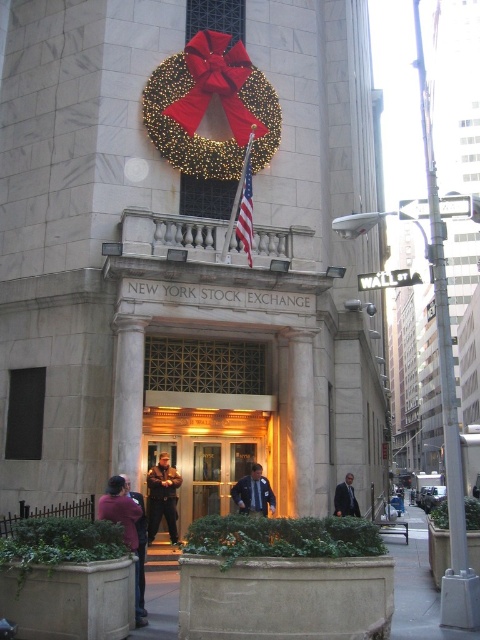
Is iridescent gold wreath at upper center thinner than american flag at center?

In fact, iridescent gold wreath at upper center might be wider than american flag at center.

Is iridescent gold wreath at upper center below american flag at center?

Incorrect, iridescent gold wreath at upper center is not positioned below american flag at center.

Does point (249, 113) come closer to viewer compared to point (242, 216)?

No.

At what (x,y) coordinates should I click in order to perform the action: click on iridescent gold wreath at upper center. Please return your answer as a coordinate pair (x, y). The width and height of the screenshot is (480, 640). Looking at the image, I should click on (206, 106).

Which is above, brown leather jacket at center or dark purple jacket at lower left?

Positioned higher is dark purple jacket at lower left.

Between brown leather jacket at center and dark purple jacket at lower left, which one is positioned lower?

Positioned lower is brown leather jacket at center.

Does point (158, 518) lie in front of point (136, 529)?

No.

You are a GUI agent. You are given a task and a screenshot of the screen. Output one action in this format:
    pyautogui.click(x=<x>, y=<y>)
    Task: Click on the brown leather jacket at center
    The image size is (480, 640).
    Given the screenshot: What is the action you would take?
    pyautogui.click(x=163, y=497)

The image size is (480, 640). Identify the location of dark purple jacket at lower left. (139, 554).

How far apart are dark purple jacket at lower left and dark gray suit at center?

dark purple jacket at lower left and dark gray suit at center are 57.29 feet apart.

The width and height of the screenshot is (480, 640). What do you see at coordinates (139, 554) in the screenshot?
I see `dark purple jacket at lower left` at bounding box center [139, 554].

This screenshot has width=480, height=640. What are the coordinates of `dark purple jacket at lower left` in the screenshot? It's located at (139, 554).